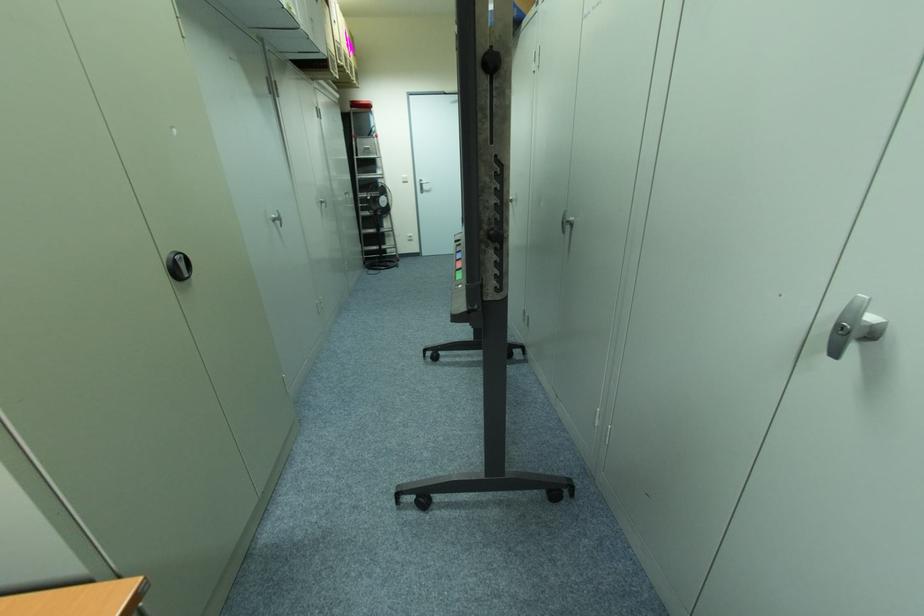
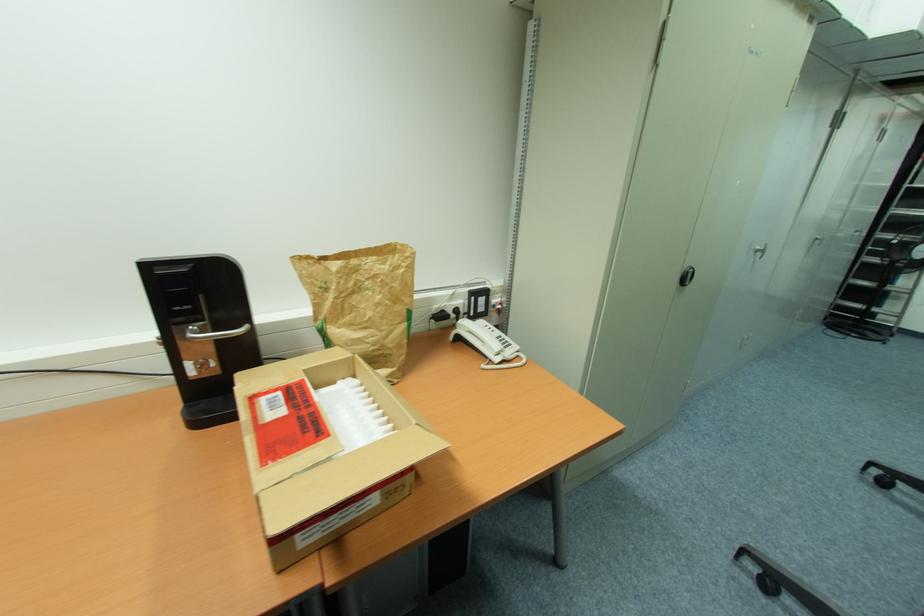
Question: The camera is either moving clockwise (left) or counter-clockwise (right) around the object. The first image is from the beginning of the video and the second image is from the end. Is the camera moving left or right when shooting the video?

Choices:
 (A) Left
 (B) Right

Answer: (B)